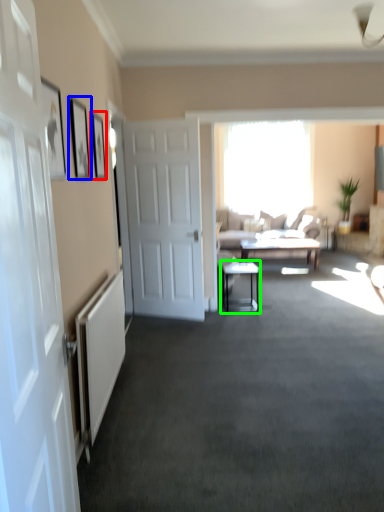
Question: Which object is the closest to the picture frame (highlighted by a red box)? Choose among these: picture frame (highlighted by a blue box) or table (highlighted by a green box).

Choices:
 (A) picture frame
 (B) table

Answer: (A)